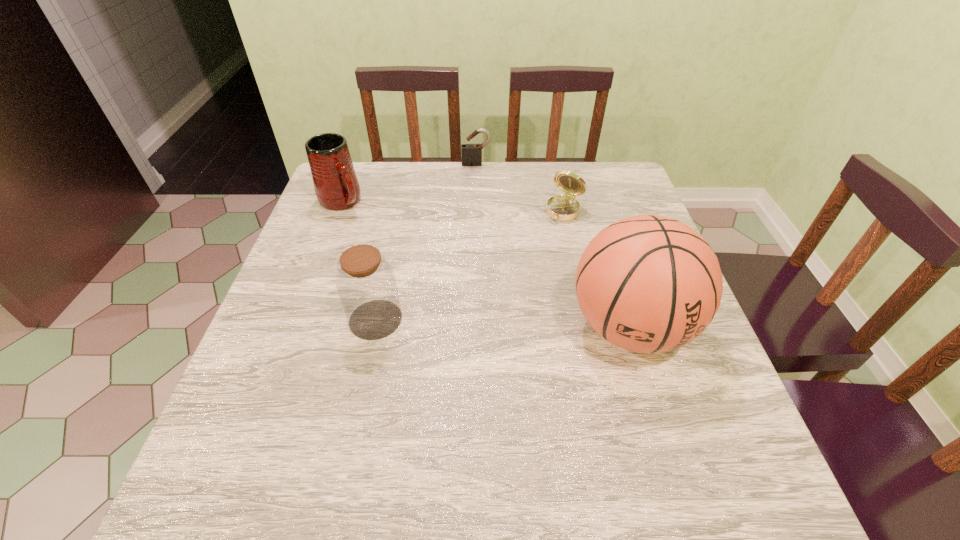
The width and height of the screenshot is (960, 540). I want to click on object identified as the second closest to the tallest object, so click(x=366, y=284).

I want to click on vacant region that satisfies the following two spatial constraints: 1. on the back side of the fourth object from right to left; 2. on the left side of the padlock, so click(409, 164).

The width and height of the screenshot is (960, 540). I want to click on vacant region that satisfies the following two spatial constraints: 1. on the front side of the compass; 2. on the left side of the padlock, so coord(476,212).